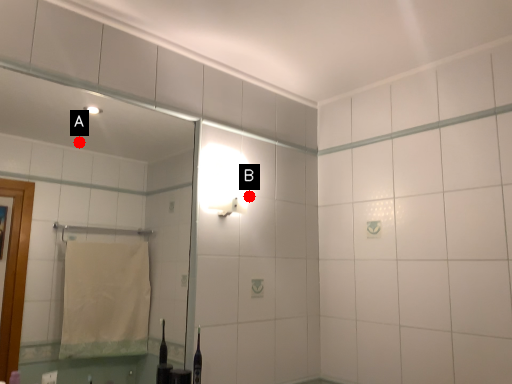
Question: Two points are circled on the image, labeled by A and B beside each circle. Which point is closer to the camera?

Choices:
 (A) A is closer
 (B) B is closer

Answer: (B)